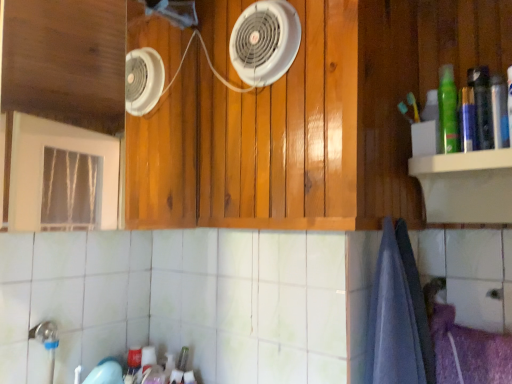
Question: Is point (376, 274) closer or farther from the camera than point (271, 59)?

Choices:
 (A) farther
 (B) closer

Answer: (B)

Question: From a real-world perspective, is blue cotton bath towel at lower right physically located above or below white plastic fan at upper center?

Choices:
 (A) above
 (B) below

Answer: (B)

Question: Based on their relative distances, which object is farther from the green matte bottle at upper right?

Choices:
 (A) white plastic fan at upper center
 (B) wooden cabinet at center
 (C) blue cotton bath towel at lower right

Answer: (B)

Question: Which object is the farthest from the white plastic fan at upper center?

Choices:
 (A) wooden cabinet at center
 (B) green matte bottle at upper right
 (C) blue cotton bath towel at lower right

Answer: (C)